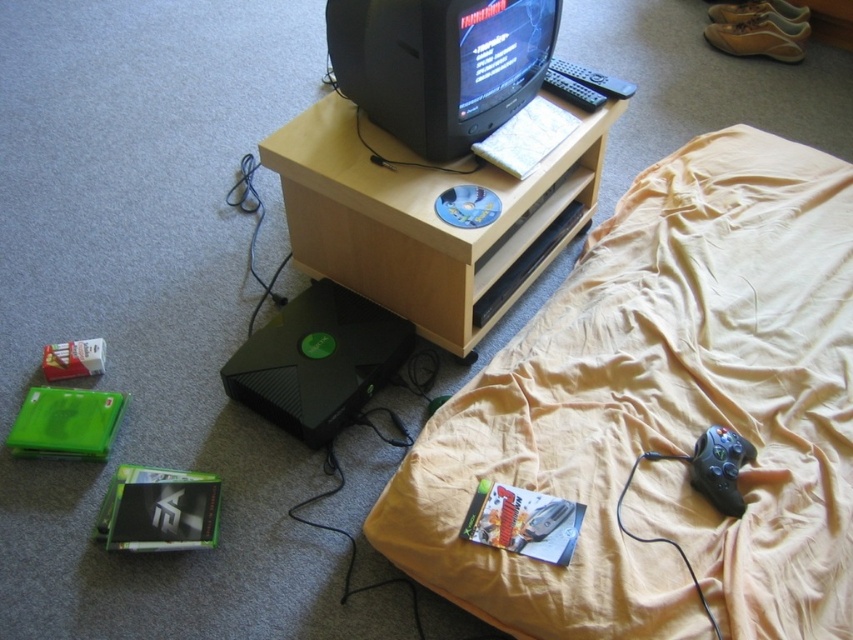
Which is below, wooden table at center or black plastic remote at upper center?

wooden table at center

Is wooden table at center shorter than black plastic remote at upper center?

No.

I want to click on wooden table at center, so click(427, 216).

Is point (809, 596) closer to camera compared to point (445, 166)?

Yes.

Who is lower down, beige fabric bed at upper right or wooden table at center?

beige fabric bed at upper right

Who is more distant from viewer, (538, 564) or (306, 214)?

Point (306, 214)

Locate an element on the screen. The image size is (853, 640). beige fabric bed at upper right is located at coordinates (664, 413).

Between beige fabric bed at upper right and black plastic remote at upper center, which one has less height?

black plastic remote at upper center is shorter.

Which is in front, point (811, 477) or point (589, 83)?

Point (811, 477) is more forward.

Image resolution: width=853 pixels, height=640 pixels. Find the location of `beige fabric bed at upper right`. beige fabric bed at upper right is located at coordinates (664, 413).